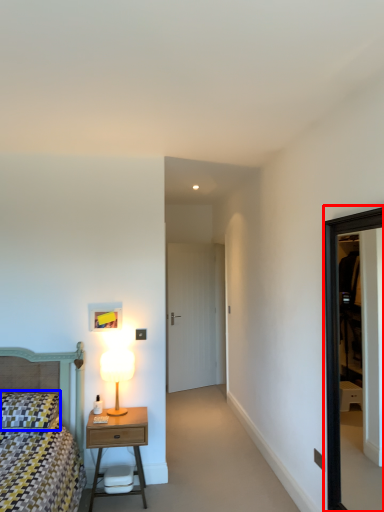
Question: Which point is further to the camera, window (highlighted by a red box) or pillow (highlighted by a blue box)?

Choices:
 (A) window
 (B) pillow

Answer: (B)